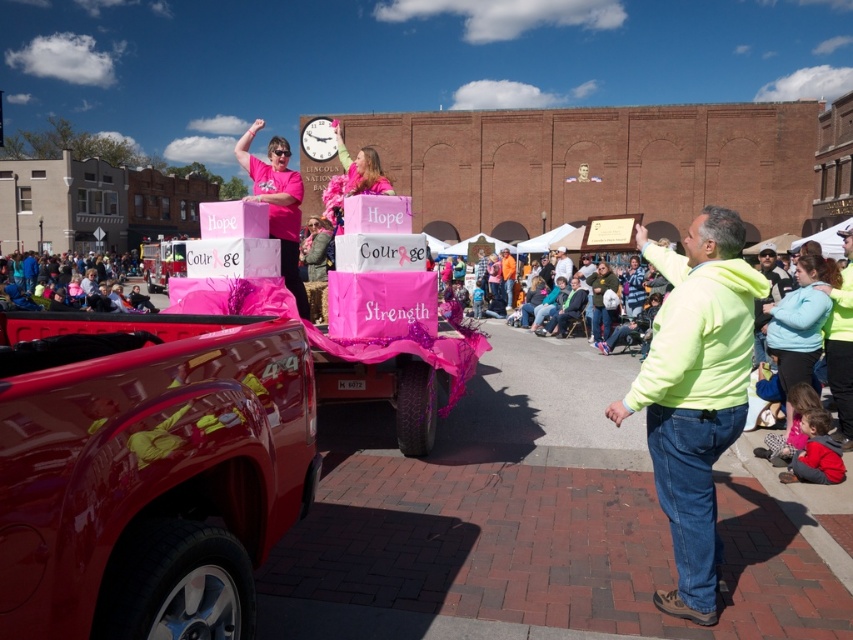
Question: Among these objects, which one is nearest to the camera?

Choices:
 (A) pink fabric crowd at lower left
 (B) neon yellow fleece at center
 (C) matte pink shirt at center
 (D) light blue fleece jacket at lower right

Answer: (B)

Question: Does neon yellow fleece at center have a lesser width compared to matte pink shirt at center?

Choices:
 (A) no
 (B) yes

Answer: (B)

Question: Can you confirm if light blue fleece jacket at lower right is positioned below pink fabric crowd at lower left?

Choices:
 (A) no
 (B) yes

Answer: (B)

Question: Among these objects, which one is nearest to the camera?

Choices:
 (A) shiny red truck at lower left
 (B) pink fabric crowd at lower left

Answer: (A)

Question: Which of the following is the farthest from the observer?

Choices:
 (A) (711, 216)
 (B) (601, 266)
 (C) (784, 321)

Answer: (B)

Question: Where is shiny red truck at lower left located in relation to pink fabric crowd at lower left in the image?

Choices:
 (A) right
 (B) left

Answer: (A)